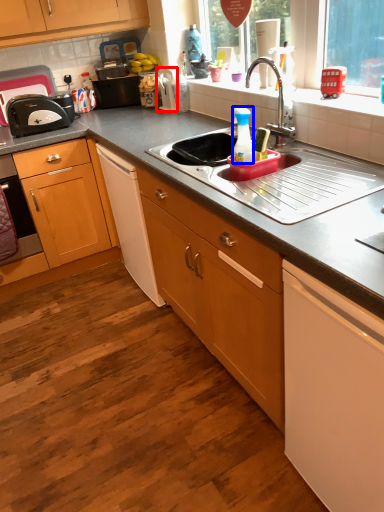
Question: Among these objects, which one is nearest to the camera, appliance (highlighted by a red box) or bottle (highlighted by a blue box)?

Choices:
 (A) appliance
 (B) bottle

Answer: (B)